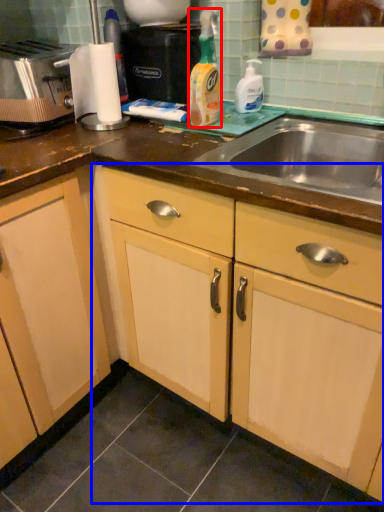
Question: Which object is further to the camera taking this photo, cleaning product (highlighted by a red box) or cabinetry (highlighted by a blue box)?

Choices:
 (A) cleaning product
 (B) cabinetry

Answer: (A)